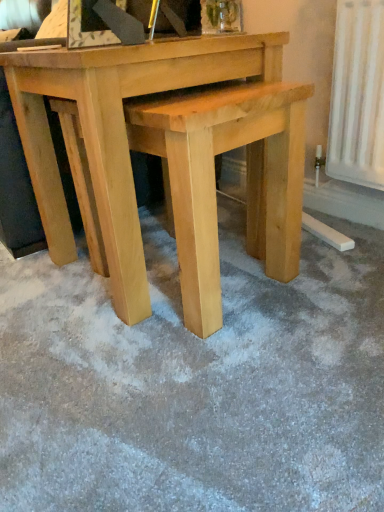
Describe the element at coordinates (215, 183) in the screenshot. This screenshot has height=512, width=384. I see `natural wood stool at center` at that location.

At what (x,y) coordinates should I click in order to perform the action: click on natural wood stool at center. Please return your answer as a coordinate pair (x, y). This screenshot has width=384, height=512. Looking at the image, I should click on (215, 183).

Find the location of a particular element. natural wood stool at center is located at coordinates coord(215,183).